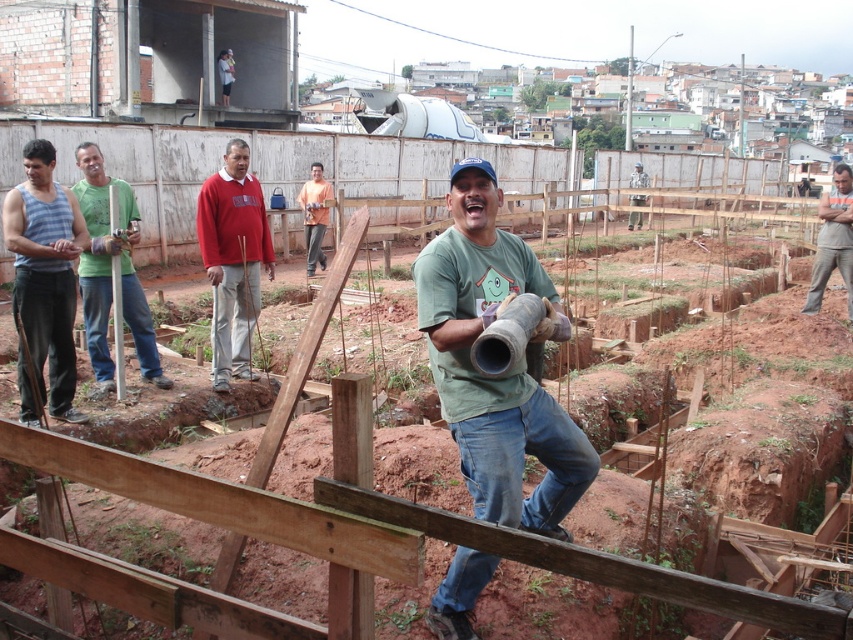
You are a safety inspector at the construction site and need to ensure that all workers are within a 70 feet safety zone. Are both the green matte shirt at center and the camouflage fabric shirt at center within the safety zone?

The green matte shirt at center is 73.17 feet away from camouflage fabric shirt at center, which exceeds the 70 feet safety zone. Therefore, at least one of them is outside the safety zone.

You are standing at the construction site and want to reach the point marked at coordinates (x=39, y=364). If you take a step forward of 1 meter, will you be closer to the point?

The point marked at coordinates (x=39, y=364) is 5.52 meters away from you. Taking a 1 meter step forward will reduce the distance to 4.52 meters, so yes, you will be closer to the point.